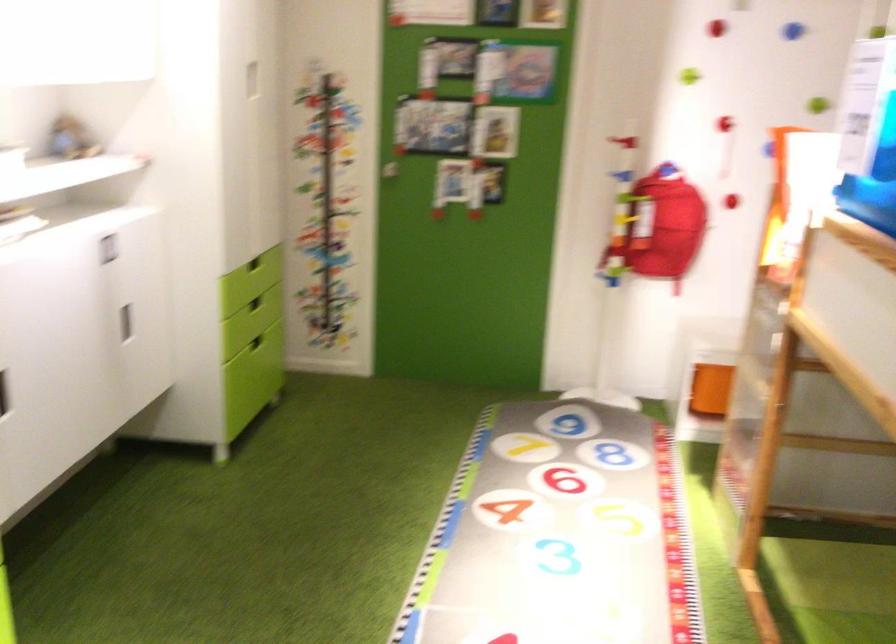
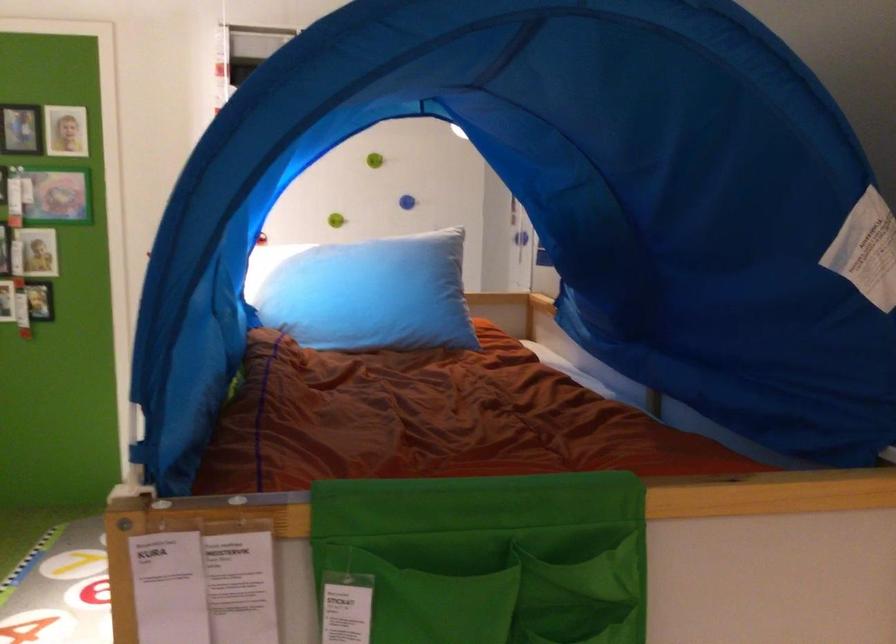
Question: The camera is either moving clockwise (left) or counter-clockwise (right) around the object. The first image is from the beginning of the video and the second image is from the end. Is the camera moving left or right when shooting the video?

Choices:
 (A) Left
 (B) Right

Answer: (A)